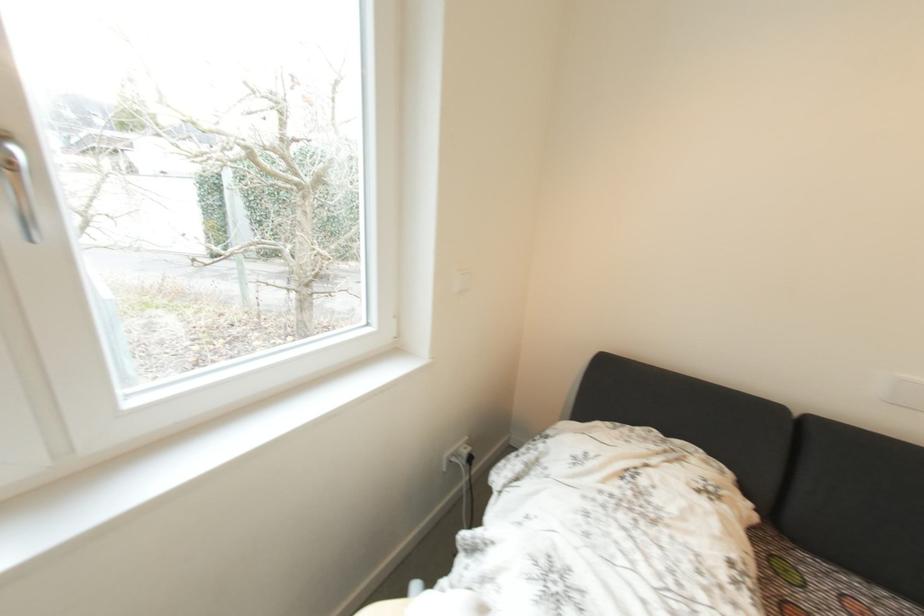
You are a GUI agent. You are given a task and a screenshot of the screen. Output one action in this format:
    pyautogui.click(x=<x>, y=<y>)
    Task: Click on the silver window handle
    The image size is (924, 616).
    Given the screenshot: What is the action you would take?
    pyautogui.click(x=19, y=188)